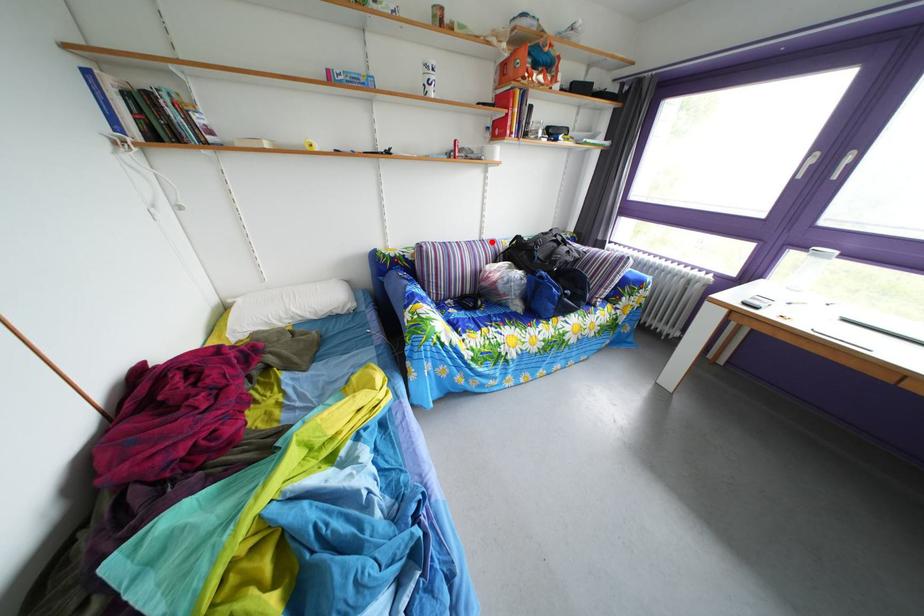
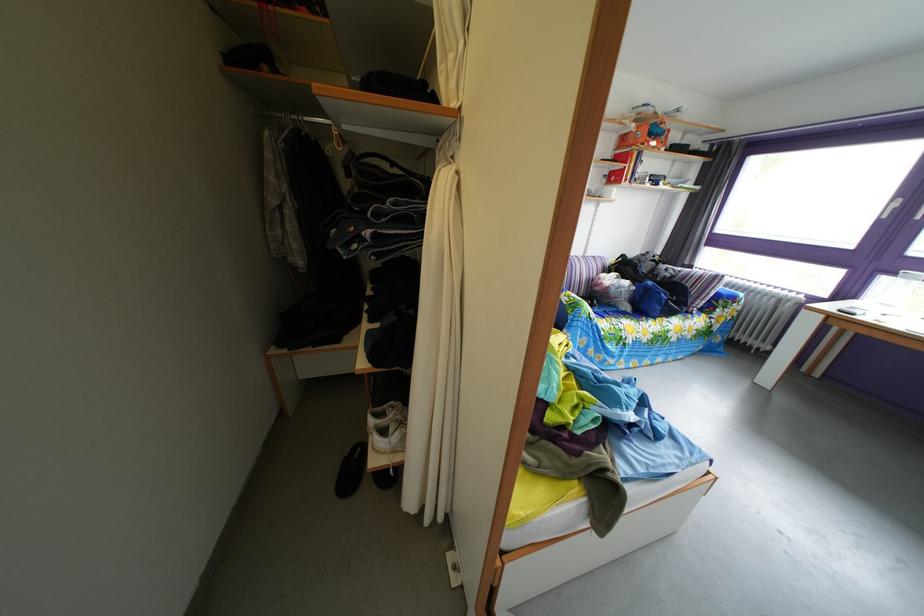
Question: A red point is marked in image1. In image2, is the corresponding 3D point closer to the camera or farther? Reply with the corresponding letter.

Choices:
 (A) The corresponding 3D point is closer.
 (B) The corresponding 3D point is farther.

Answer: (B)